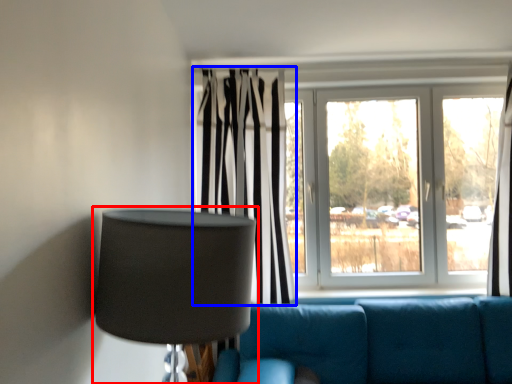
Question: Which object appears closest to the camera in this image, lamp (highlighted by a red box) or curtain (highlighted by a blue box)?

Choices:
 (A) lamp
 (B) curtain

Answer: (A)